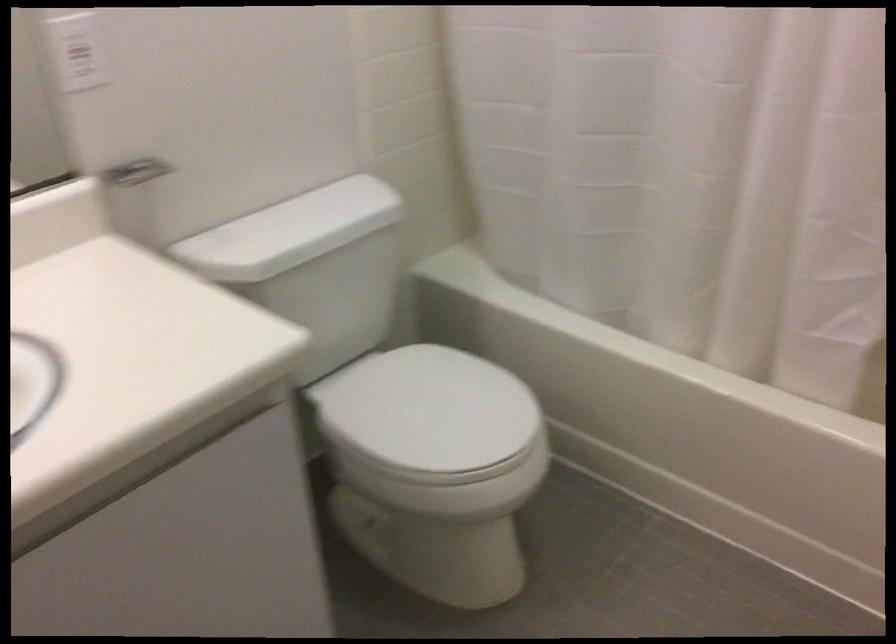
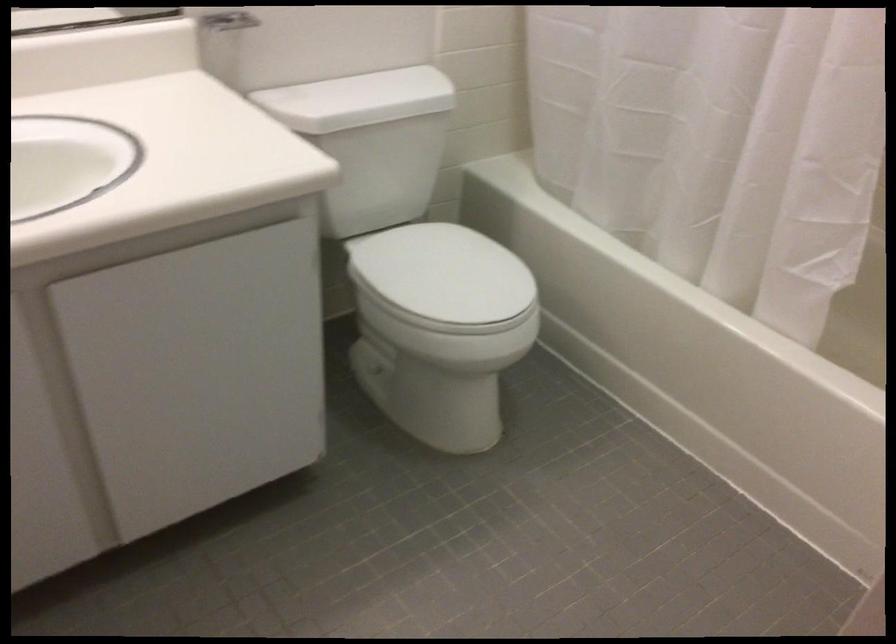
Question: The camera is either moving clockwise (left) or counter-clockwise (right) around the object. The first image is from the beginning of the video and the second image is from the end. Is the camera moving left or right when shooting the video?

Choices:
 (A) Left
 (B) Right

Answer: (B)